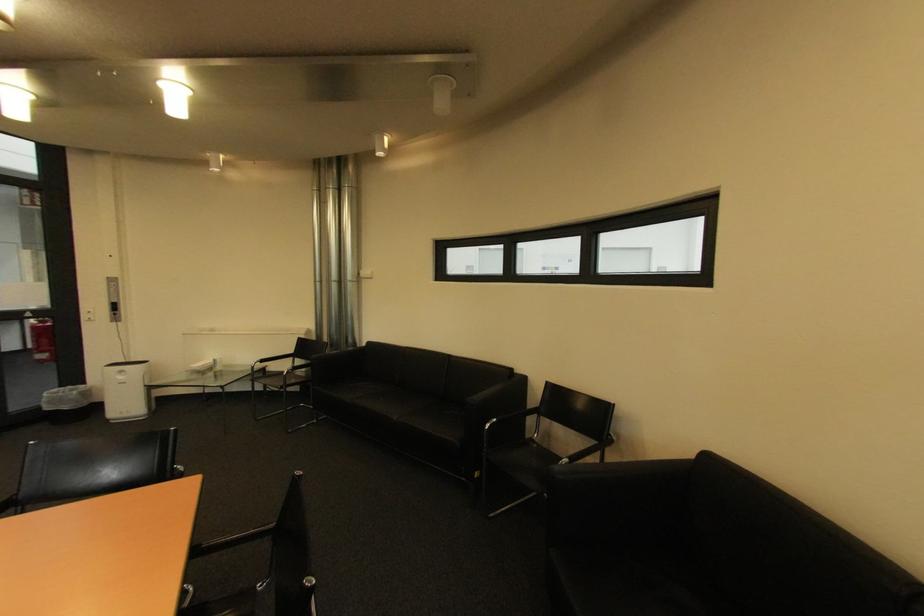
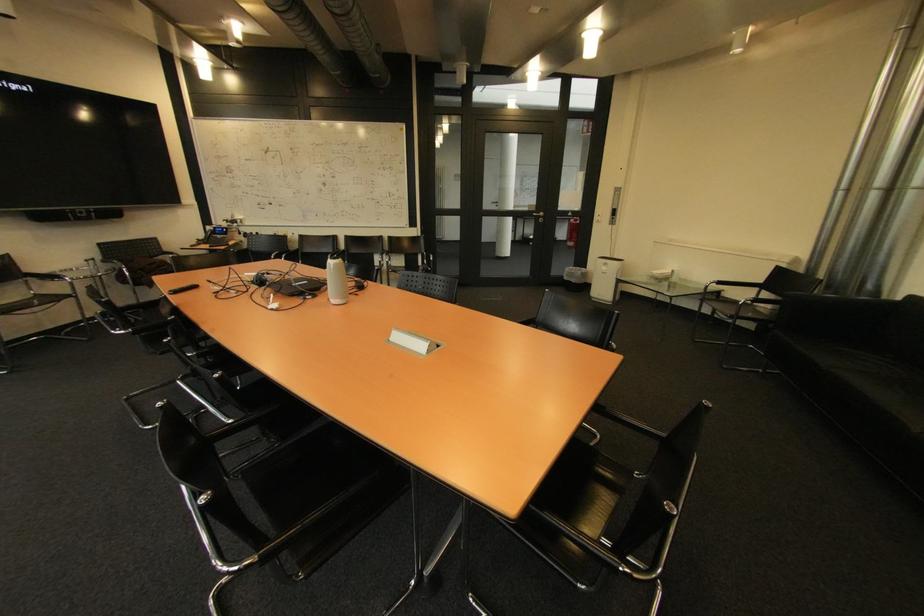
Locate, in the second image, the point that corresponds to the point at 55,410 in the first image.

(574, 280)